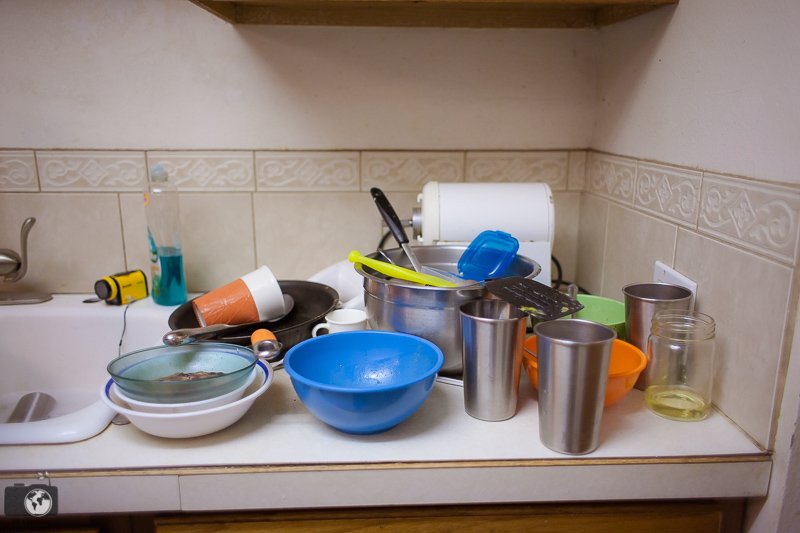
The width and height of the screenshot is (800, 533). I want to click on faucet, so click(14, 259).